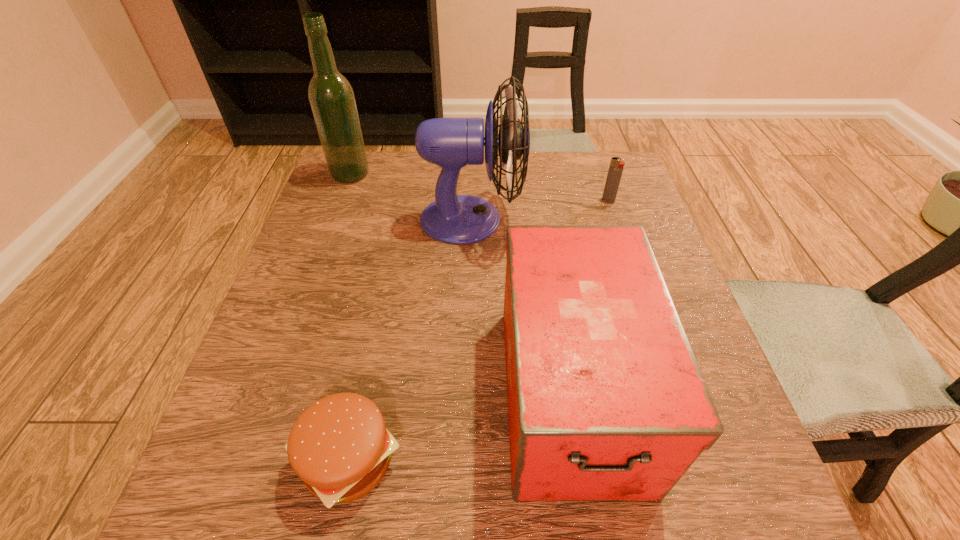
Identify the location of vacant space in between the fan and the hamburger. This screenshot has width=960, height=540. (410, 339).

Locate an element on the screen. This screenshot has height=540, width=960. vacant space that's between the liquor and the hamburger is located at coordinates (349, 317).

Locate an element on the screen. This screenshot has height=540, width=960. free area in between the farthest object and the second tallest object is located at coordinates (411, 197).

At what (x,y) coordinates should I click in order to perform the action: click on free spot between the leftmost object and the second shortest object. Please return your answer as a coordinate pair (x, y). Looking at the image, I should click on (479, 187).

The image size is (960, 540). Identify the location of free spot between the shortest object and the fan. (410, 339).

What are the coordinates of `the closest object to the first-aid kit` in the screenshot? It's located at (339, 446).

Locate which object ranks third in proximity to the rightmost object. Please provide its 2D coordinates. Your answer should be formatted as a tuple, i.e. [(x, y)], where the tuple contains the x and y coordinates of a point satisfying the conditions above.

[(332, 100)]